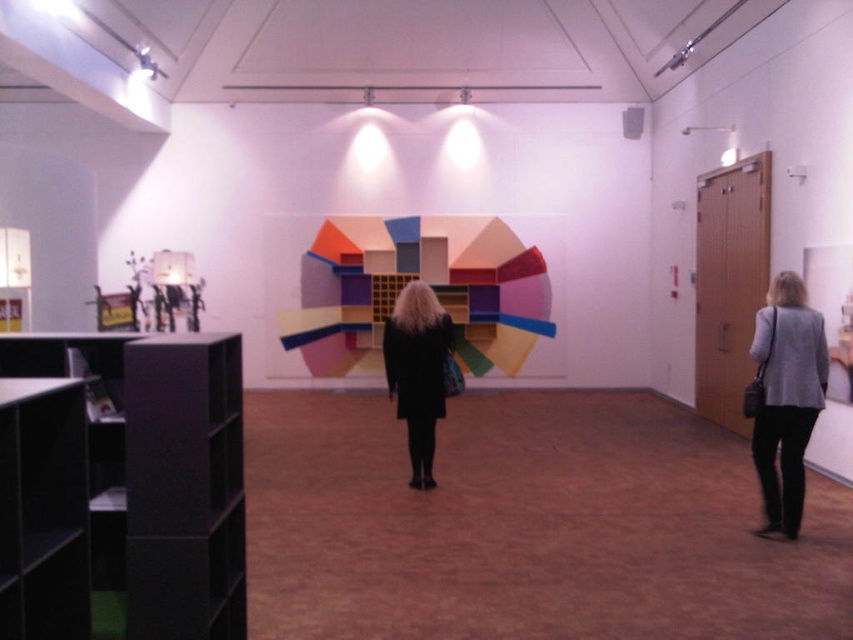
You are an interior designer planning to place a new sofa in the gallery. The sofa is 1.8 meters wide. You see the matte black bookshelf at left and the gray fabric jacket at lower right. Which object should you consider in terms of space when placing the sofa?

The matte black bookshelf at left has a larger size compared to the gray fabric jacket at lower right, so you should consider the space occupied by the matte black bookshelf at left when placing the sofa to ensure proper spacing.

You are an art curator who wants to install a new sculpture that is 3 meters wide between the multicolored painted geometric shapes at center and the black matte coat at center. Is there enough space between them to accommodate the new sculpture?

The multicolored painted geometric shapes at center and the black matte coat at center are 4.57 meters apart from each other. Since the new sculpture is 3 meters wide, there is enough space between them to accommodate the new sculpture.